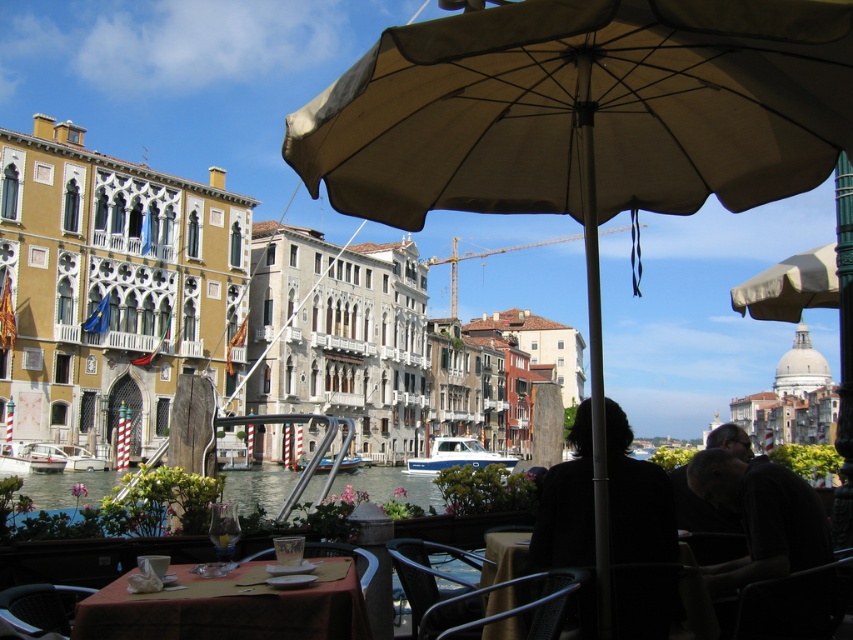
Question: Can you confirm if dark brown leather chair at lower right is positioned below white glossy boat at center?

Choices:
 (A) no
 (B) yes

Answer: (A)

Question: Which point is farther to the camera?

Choices:
 (A) (321, 460)
 (B) (850, 564)

Answer: (A)

Question: Which of the following is the farthest from the observer?

Choices:
 (A) metallic silver chair at lower center
 (B) black matte jacket at center

Answer: (A)

Question: Which of the following is the farthest from the observer?

Choices:
 (A) (445, 616)
 (B) (308, 541)

Answer: (B)

Question: Is metallic silver table at center further to camera compared to wooden chair at lower center?

Choices:
 (A) yes
 (B) no

Answer: (B)

Question: Where is metallic silver table at center located in relation to wooden chair at lower center in the image?

Choices:
 (A) above
 (B) below

Answer: (B)